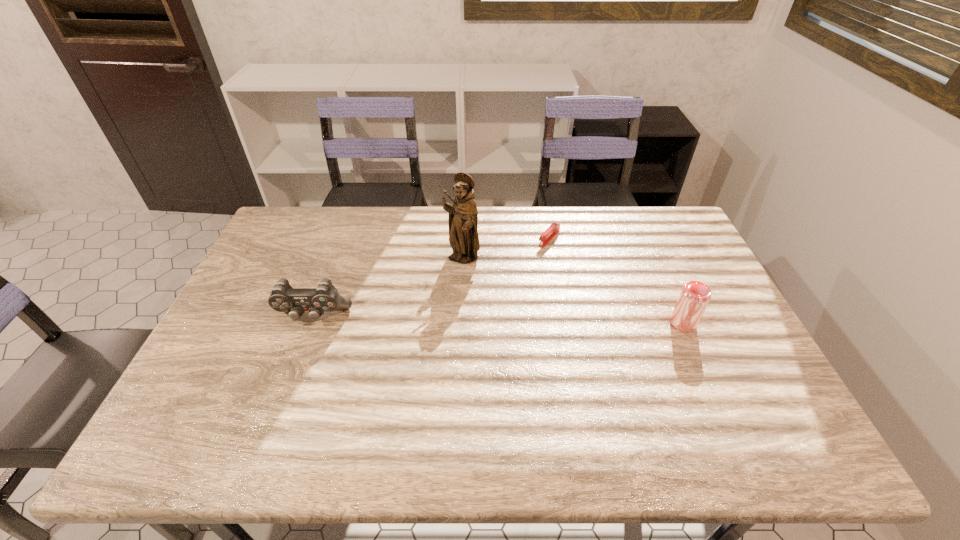
You are a GUI agent. You are given a task and a screenshot of the screen. Output one action in this format:
    pyautogui.click(x=<x>, y=<y>)
    Task: Click on the free space located 0.390m on the front-facing side of the shortest object
    This screenshot has height=540, width=960.
    Given the screenshot: What is the action you would take?
    pyautogui.click(x=475, y=316)

Locate an element on the screen. This screenshot has height=540, width=960. vacant area located 0.250m on the front-facing side of the third object from right to left is located at coordinates (445, 332).

Where is `free space located 0.270m on the front-facing side of the third object from right to left`? The width and height of the screenshot is (960, 540). free space located 0.270m on the front-facing side of the third object from right to left is located at coordinates (444, 338).

Locate an element on the screen. vacant space located 0.110m on the front-facing side of the third object from right to left is located at coordinates (454, 296).

Image resolution: width=960 pixels, height=540 pixels. I want to click on object positioned at the far edge, so point(554,228).

Locate an element on the screen. object present at the left edge is located at coordinates (325, 298).

What are the coordinates of `object that is at the right edge` in the screenshot? It's located at (694, 297).

Locate an element on the screen. This screenshot has height=540, width=960. free spot at the far edge of the desktop is located at coordinates (354, 226).

This screenshot has width=960, height=540. In the image, there is a desktop. In order to click on vacant space at the near edge in this screenshot , I will do `click(420, 408)`.

Where is `vacant space at the left edge of the desktop`? The image size is (960, 540). vacant space at the left edge of the desktop is located at coordinates (x=226, y=352).